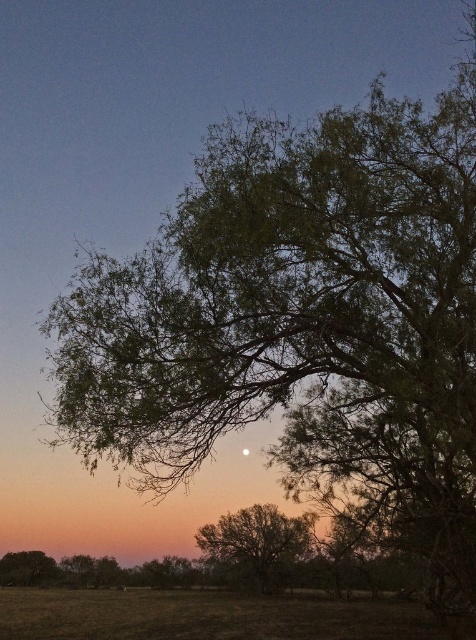
Question: Among these objects, which one is farthest from the camera?

Choices:
 (A) bright silver moon at upper center
 (B) green grassy field at lower center

Answer: (A)

Question: Which object appears closest to the camera in this image?

Choices:
 (A) green leafy tree at lower left
 (B) green leafy tree at center
 (C) bright silver moon at upper center

Answer: (C)

Question: Does green grassy field at lower center come behind green leafy tree at lower left?

Choices:
 (A) no
 (B) yes

Answer: (A)

Question: Is green leafy tree at lower left bigger than bright silver moon at upper center?

Choices:
 (A) no
 (B) yes

Answer: (B)

Question: Does green leafy tree at lower left appear on the left side of bright silver moon at upper center?

Choices:
 (A) yes
 (B) no

Answer: (A)

Question: Which of the following is the closest to the observer?

Choices:
 (A) (15, 564)
 (B) (244, 449)
 (C) (234, 564)

Answer: (B)